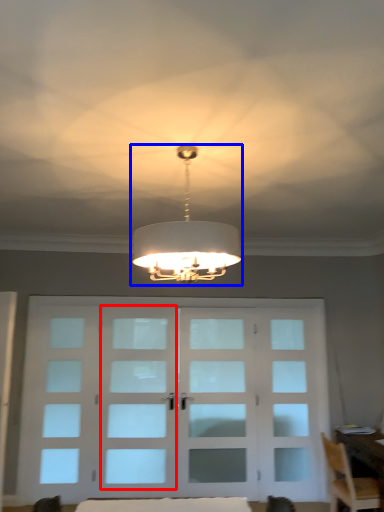
Question: Which point is further to the camera, screen door (highlighted by a red box) or lamp (highlighted by a blue box)?

Choices:
 (A) screen door
 (B) lamp

Answer: (A)